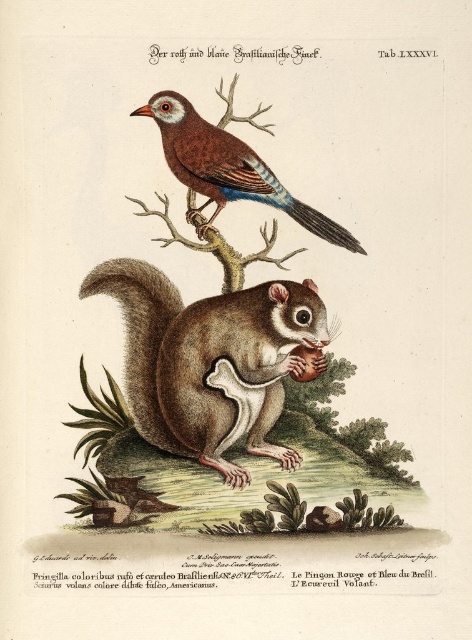
Question: Which point is farther to the camera?

Choices:
 (A) brown glossy bird at upper center
 (B) brown furry squirrel at lower center

Answer: (B)

Question: Which point is farther to the camera?

Choices:
 (A) smooth brown squirrel at center
 (B) brown furry squirrel at lower center

Answer: (B)

Question: Is smooth brown squirrel at center positioned in front of brown furry squirrel at lower center?

Choices:
 (A) yes
 (B) no

Answer: (A)

Question: Considering the relative positions of brown furry squirrel at lower center and brown glossy bird at upper center in the image provided, where is brown furry squirrel at lower center located with respect to brown glossy bird at upper center?

Choices:
 (A) below
 (B) above

Answer: (A)

Question: Is brown furry squirrel at lower center smaller than brown glossy bird at upper center?

Choices:
 (A) no
 (B) yes

Answer: (A)

Question: Which of the following is the farthest from the observer?

Choices:
 (A) smooth brown squirrel at center
 (B) brown furry squirrel at lower center
 (C) brown glossy bird at upper center

Answer: (B)